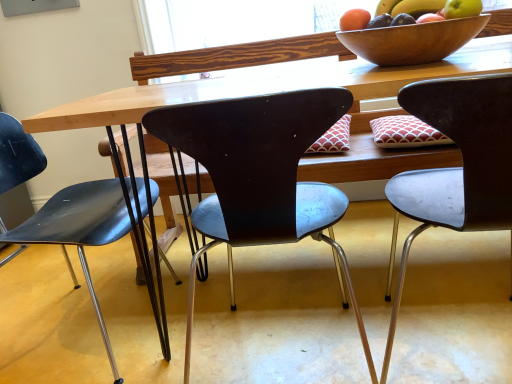
Question: Can you see wooden bowl at upper right touching metallic gray chair at right, which is the 1th chair in right-to-left order?

Choices:
 (A) yes
 (B) no

Answer: (B)

Question: Is wooden bowl at upper right aimed at metallic gray chair at right, which appears as the third chair when viewed from the left?

Choices:
 (A) no
 (B) yes

Answer: (A)

Question: Is wooden bowl at upper right bigger than metallic gray chair at right, which is the 1th chair in right-to-left order?

Choices:
 (A) no
 (B) yes

Answer: (A)

Question: From a real-world perspective, is wooden bowl at upper right physically below metallic gray chair at right, which is the 1th chair in right-to-left order?

Choices:
 (A) no
 (B) yes

Answer: (A)

Question: Considering the relative positions of wooden bowl at upper right and metallic gray chair at right, which appears as the third chair when viewed from the left, in the image provided, is wooden bowl at upper right in front of metallic gray chair at right, which appears as the third chair when viewed from the left,?

Choices:
 (A) yes
 (B) no

Answer: (B)

Question: Is wooden bowl at upper right not within metallic gray chair at right, which is the 1th chair in right-to-left order?

Choices:
 (A) yes
 (B) no

Answer: (A)

Question: Considering the relative sizes of orange matte grapefruit at upper right and matte black chair at center, the second chair positioned from the right, in the image provided, is orange matte grapefruit at upper right smaller than matte black chair at center, the second chair positioned from the right,?

Choices:
 (A) no
 (B) yes

Answer: (B)

Question: Is orange matte grapefruit at upper right not within matte black chair at center, which is the second chair in left-to-right order?

Choices:
 (A) no
 (B) yes

Answer: (B)

Question: Can you confirm if orange matte grapefruit at upper right is thinner than matte black chair at center, which is the second chair in left-to-right order?

Choices:
 (A) no
 (B) yes

Answer: (B)

Question: Does orange matte grapefruit at upper right lie behind matte black chair at center, the second chair positioned from the right?

Choices:
 (A) yes
 (B) no

Answer: (A)

Question: From the image's perspective, is orange matte grapefruit at upper right on matte black chair at center, the second chair positioned from the right?

Choices:
 (A) no
 (B) yes

Answer: (B)

Question: Is orange matte grapefruit at upper right facing towards matte black chair at center, which is the second chair in left-to-right order?

Choices:
 (A) yes
 (B) no

Answer: (B)

Question: Considering the relative sizes of metallic gray chair at right, which appears as the third chair when viewed from the left, and matte black chair at center, which is the first chair from left to right, in the image provided, is metallic gray chair at right, which appears as the third chair when viewed from the left, taller than matte black chair at center, which is the first chair from left to right,?

Choices:
 (A) yes
 (B) no

Answer: (A)